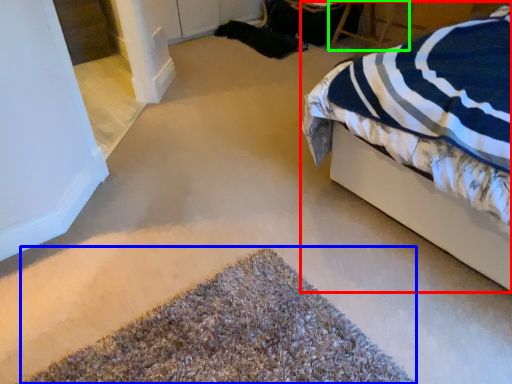
Question: Considering the real-world distances, which object is closest to bed (highlighted by a red box)? door (highlighted by a blue box) or chair (highlighted by a green box).

Choices:
 (A) door
 (B) chair

Answer: (A)